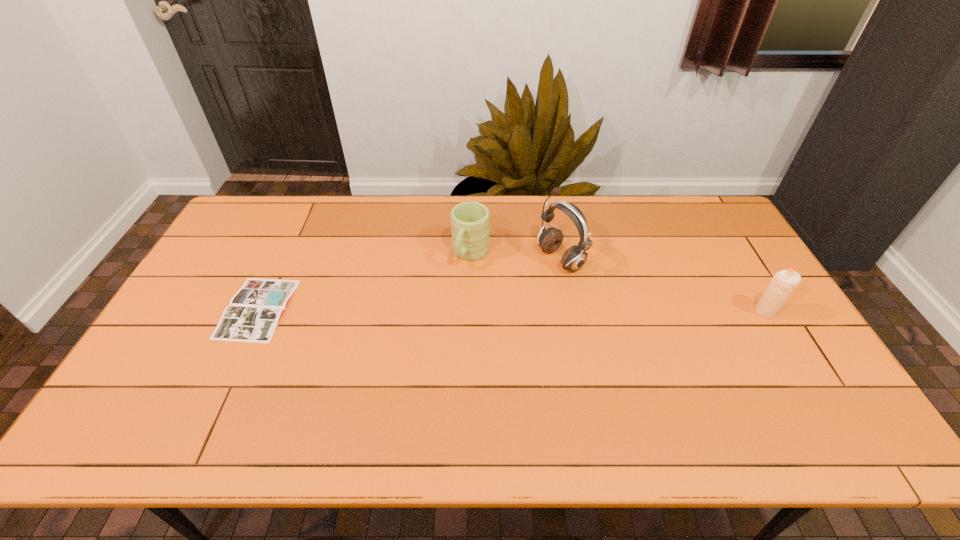
Identify the location of vacant space on the desktop that is between the shortest object and the second tallest object and is positioned on the ear pads of the tallest object. (465, 310).

Locate an element on the screen. The width and height of the screenshot is (960, 540). vacant space on the desktop that is between the book and the rightmost object and is positioned on the side of the third tallest object with the handle is located at coordinates (440, 310).